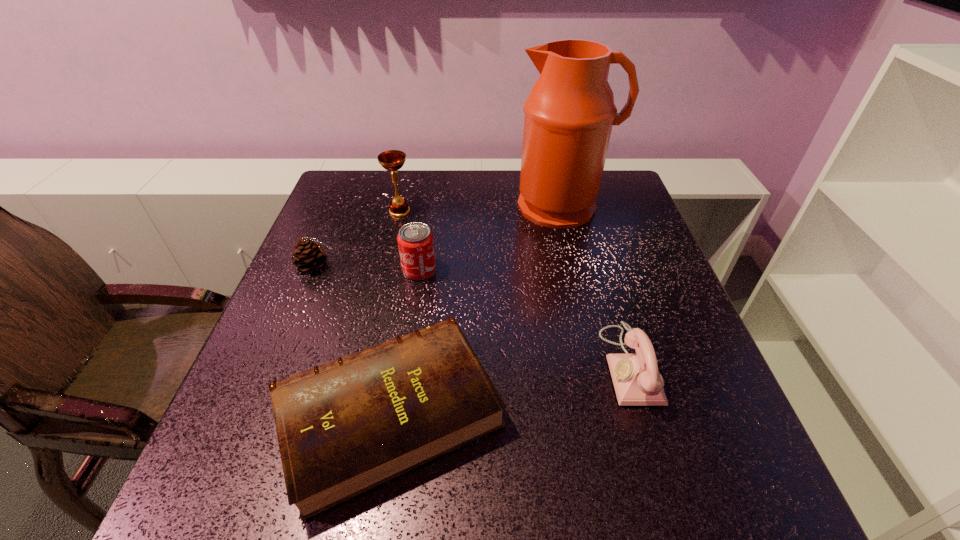
Identify the location of vacant region located 0.050m on the dial of the telephone. (581, 365).

Where is `vacant area situated 0.370m on the dial of the telephone`? Image resolution: width=960 pixels, height=540 pixels. vacant area situated 0.370m on the dial of the telephone is located at coordinates (417, 365).

This screenshot has width=960, height=540. Identify the location of vacant space located 0.160m with a leaf charm attached to the fifth tallest object. (401, 266).

Identify the location of vacant point located 0.120m on the back of the shortest object. The width and height of the screenshot is (960, 540). (409, 293).

What are the coordinates of `water jug at the far edge` in the screenshot? It's located at (569, 114).

Find the location of a particular element. Image resolution: width=960 pixels, height=540 pixels. chalice that is at the far edge is located at coordinates (392, 160).

The width and height of the screenshot is (960, 540). What are the coordinates of `object present at the near edge` in the screenshot? It's located at (344, 427).

The image size is (960, 540). In order to click on pinecone that is at the left edge in this screenshot , I will do `click(309, 255)`.

The image size is (960, 540). Identify the location of hardback book that is positioned at the left edge. (344, 427).

Locate an element on the screen. water jug at the right edge is located at coordinates (569, 114).